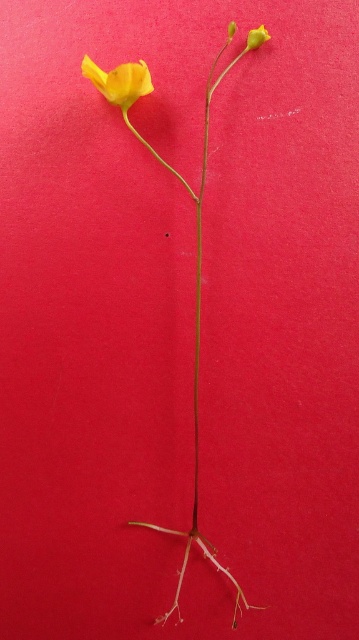
Can you confirm if yellow matte flower at center is wider than matte yellow flower at upper left?

Yes.

The image size is (359, 640). In order to click on yellow matte flower at center in this screenshot , I will do coord(197,355).

The width and height of the screenshot is (359, 640). I want to click on matte yellow flower at upper left, so click(x=119, y=81).

Based on the photo, measure the distance between point (133, 88) and camera.

Point (133, 88) is 1.23 meters away from camera.

Which is behind, point (89, 70) or point (254, 49)?

The point (254, 49) is more distant.

Locate an element on the screen. matte yellow flower at upper left is located at coordinates (119, 81).

Does yellow matte flower at center have a smaller size compared to smooth yellow flower at upper center?

Incorrect, yellow matte flower at center is not smaller in size than smooth yellow flower at upper center.

Does yellow matte flower at center come in front of smooth yellow flower at upper center?

No.

Who is more distant from viewer, (183, 577) or (264, 40)?

The point (183, 577) is behind.

At what (x,y) coordinates should I click in order to perform the action: click on yellow matte flower at center. Please return your answer as a coordinate pair (x, y). This screenshot has height=640, width=359. Looking at the image, I should click on (197, 355).